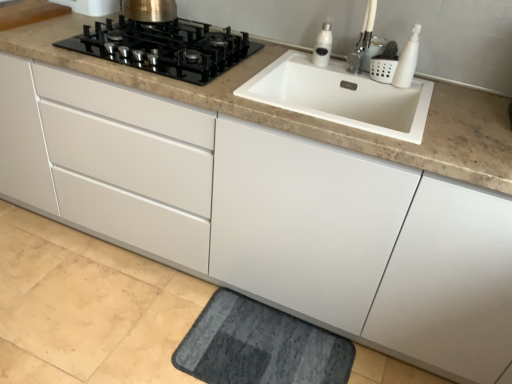
Question: In terms of width, does white glossy soap dispenser at upper right, the 1th soap dispenser positioned from the back, look wider or thinner when compared to dark gray textured bath mat at lower center?

Choices:
 (A) wide
 (B) thin

Answer: (B)

Question: Considering their positions, is white glossy soap dispenser at upper right, the 1th soap dispenser positioned from the back, located in front of or behind dark gray textured bath mat at lower center?

Choices:
 (A) front
 (B) behind

Answer: (B)

Question: Based on their relative distances, which object is nearer to the black glass gas stove at upper left?

Choices:
 (A) white glossy soap dispenser at upper right, which appears as the 2th soap dispenser when viewed from the front
 (B) white matte soap dispenser at upper right, which is counted as the 2th soap dispenser, starting from the left
 (C) white ceramic faucet at upper right
 (D) dark gray textured bath mat at lower center

Answer: (A)

Question: Which is nearer to the white glossy soap dispenser at upper right, which appears as the 2th soap dispenser when viewed from the front?

Choices:
 (A) white ceramic faucet at upper right
 (B) dark gray textured bath mat at lower center
 (C) white matte soap dispenser at upper right, which is the 1th soap dispenser from front to back
 (D) black glass gas stove at upper left

Answer: (A)